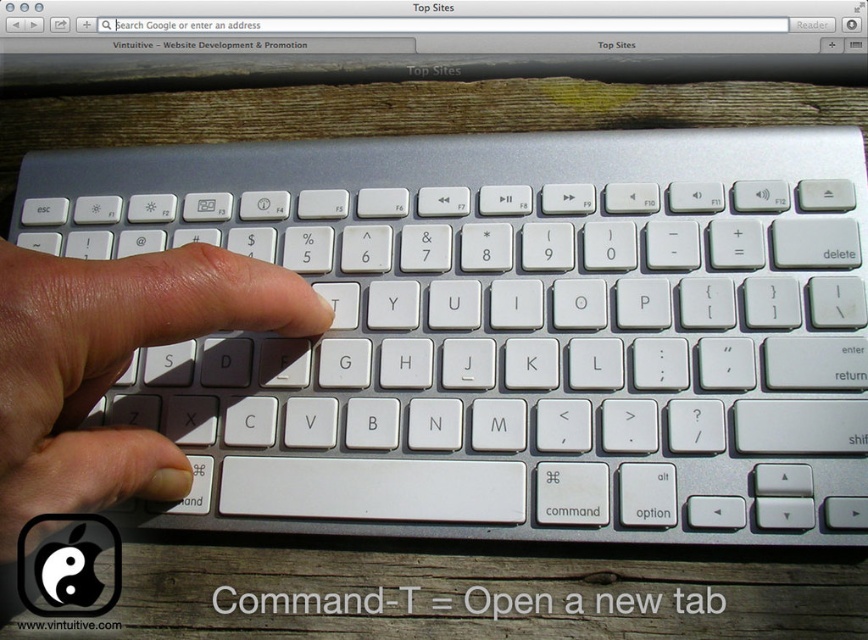
Does point (352, 209) come in front of point (656, 72)?

Yes, point (352, 209) is closer to viewer.

Is silver/plastic keyboard at center above satin silver computer screen at upper center?

No.

Between point (176, 368) and point (707, 48), which one is positioned in front?

Positioned in front is point (176, 368).

Where is `silver/plastic keyboard at center`? The image size is (868, 640). silver/plastic keyboard at center is located at coordinates (505, 332).

Between point (123, 221) and point (18, 506), which one is positioned behind?

The point (123, 221) is more distant.

Describe the element at coordinates (505, 332) in the screenshot. I see `silver/plastic keyboard at center` at that location.

The image size is (868, 640). Find the location of `silver/plastic keyboard at center`. silver/plastic keyboard at center is located at coordinates (505, 332).

Locate an element on the screen. silver/plastic keyboard at center is located at coordinates (505, 332).

Between satin silver computer screen at upper center and white matte keyboard at center, which one has more height?

white matte keyboard at center

Where is `satin silver computer screen at upper center`? The width and height of the screenshot is (868, 640). satin silver computer screen at upper center is located at coordinates (426, 38).

Based on the photo, who is more forward, (527, 58) or (221, 321)?

Point (221, 321) is more forward.

At what (x,y) coordinates should I click in order to perform the action: click on satin silver computer screen at upper center. Please return your answer as a coordinate pair (x, y). Looking at the image, I should click on (426, 38).